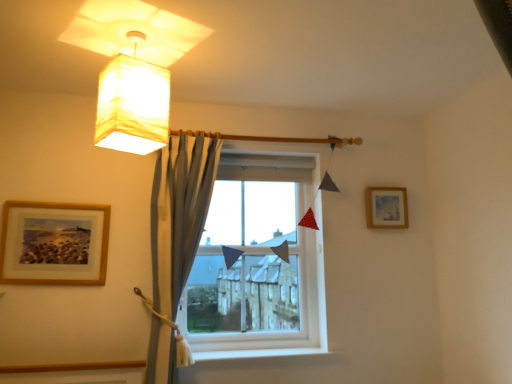
Question: Is the depth of satin blue curtain at center greater than that of wooden picture frame at left, the second picture frame viewed from the right?

Choices:
 (A) yes
 (B) no

Answer: (B)

Question: Considering the relative sizes of satin blue curtain at center and wooden picture frame at left, which is counted as the second picture frame, starting from the back, in the image provided, is satin blue curtain at center bigger than wooden picture frame at left, which is counted as the second picture frame, starting from the back,?

Choices:
 (A) no
 (B) yes

Answer: (B)

Question: Would you say wooden picture frame at left, the first picture frame in the front-to-back sequence, is part of satin blue curtain at center's contents?

Choices:
 (A) no
 (B) yes

Answer: (A)

Question: From the image's perspective, is satin blue curtain at center below wooden picture frame at left, the second picture frame viewed from the right?

Choices:
 (A) no
 (B) yes

Answer: (B)

Question: From the image's perspective, is satin blue curtain at center on wooden picture frame at left, positioned as the first picture frame in left-to-right order?

Choices:
 (A) no
 (B) yes

Answer: (A)

Question: From the image's perspective, is wooden picture frame at left, positioned as the first picture frame in left-to-right order, positioned above or below clear glass window at center?

Choices:
 (A) below
 (B) above

Answer: (B)

Question: In terms of width, does wooden picture frame at left, which is counted as the second picture frame, starting from the back, look wider or thinner when compared to clear glass window at center?

Choices:
 (A) wide
 (B) thin

Answer: (B)

Question: Based on their sizes in the image, would you say wooden picture frame at left, positioned as the first picture frame in left-to-right order, is bigger or smaller than clear glass window at center?

Choices:
 (A) big
 (B) small

Answer: (B)

Question: Is point (3, 240) positioned closer to the camera than point (242, 299)?

Choices:
 (A) closer
 (B) farther

Answer: (A)

Question: Based on their positions, is wooden picture frame at left, positioned as the first picture frame in left-to-right order, located to the left or right of satin blue curtain at center?

Choices:
 (A) right
 (B) left

Answer: (B)

Question: Is wooden picture frame at left, positioned as the first picture frame in left-to-right order, inside the boundaries of satin blue curtain at center, or outside?

Choices:
 (A) inside
 (B) outside

Answer: (B)

Question: Considering their positions, is wooden picture frame at left, which is counted as the second picture frame, starting from the back, located in front of or behind satin blue curtain at center?

Choices:
 (A) behind
 (B) front

Answer: (A)

Question: From a real-world perspective, is wooden picture frame at left, positioned as the first picture frame in left-to-right order, above or below satin blue curtain at center?

Choices:
 (A) below
 (B) above

Answer: (B)

Question: Is point (366, 200) positioned closer to the camera than point (293, 307)?

Choices:
 (A) farther
 (B) closer

Answer: (A)

Question: Considering the positions of wooden framed picture at upper right, marked as the 1th picture frame in a right-to-left arrangement, and clear glass window at center in the image, is wooden framed picture at upper right, marked as the 1th picture frame in a right-to-left arrangement, taller or shorter than clear glass window at center?

Choices:
 (A) short
 (B) tall

Answer: (A)